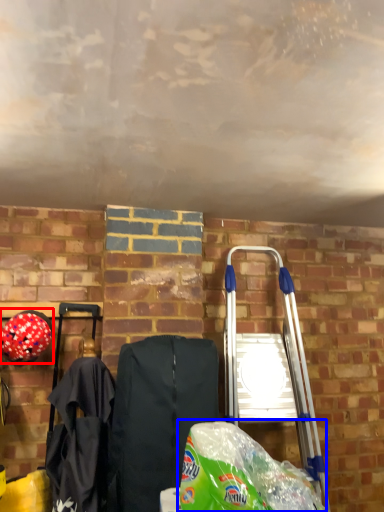
Question: Among these objects, which one is farthest to the camera, helmet (highlighted by a red box) or grocery bag (highlighted by a blue box)?

Choices:
 (A) helmet
 (B) grocery bag

Answer: (A)